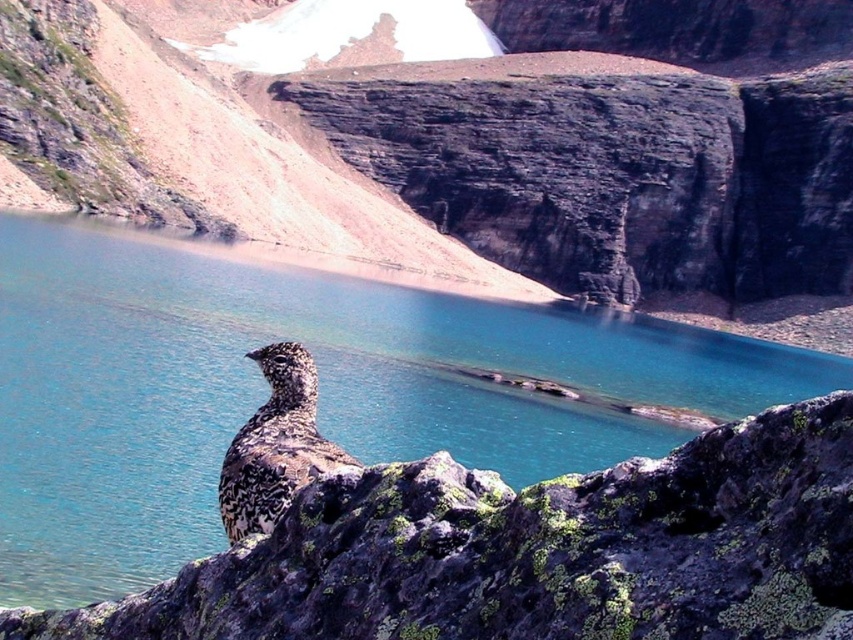
Who is more forward, (558,230) or (102,518)?

Positioned in front is point (102,518).

Can you confirm if brown rocky hillside at upper center is thinner than blue water at center?

No, brown rocky hillside at upper center is not thinner than blue water at center.

Where is `brown rocky hillside at upper center`? This screenshot has width=853, height=640. brown rocky hillside at upper center is located at coordinates click(461, 140).

Who is positioned more to the right, blue water at center or speckled feathered bird at center?

speckled feathered bird at center

From the picture: Can you confirm if blue water at center is thinner than speckled feathered bird at center?

No.

Is point (607, 388) positioned in front of point (285, 433)?

No, it is not.

Identify the location of blue water at center. (318, 392).

Does brown rocky hillside at upper center have a greater width compared to speckled feathered bird at center?

Correct, the width of brown rocky hillside at upper center exceeds that of speckled feathered bird at center.

Which of these two, brown rocky hillside at upper center or speckled feathered bird at center, stands shorter?

speckled feathered bird at center

Does point (515, 170) come farther from viewer compared to point (276, 397)?

That is True.

Image resolution: width=853 pixels, height=640 pixels. What are the coordinates of `brown rocky hillside at upper center` in the screenshot? It's located at (461, 140).